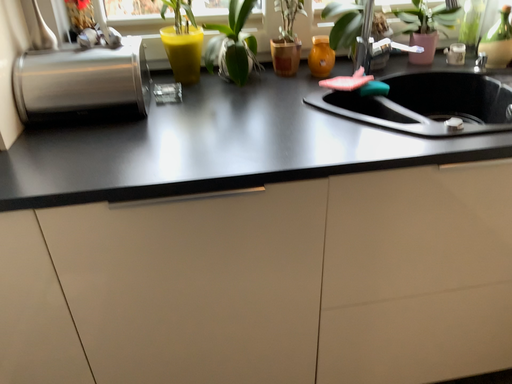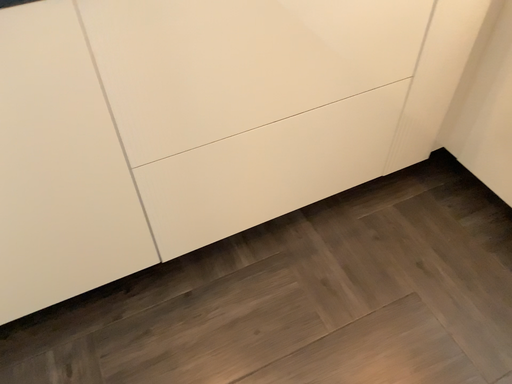
Question: Which way did the camera rotate in the video?

Choices:
 (A) rotated upward
 (B) rotated downward

Answer: (B)